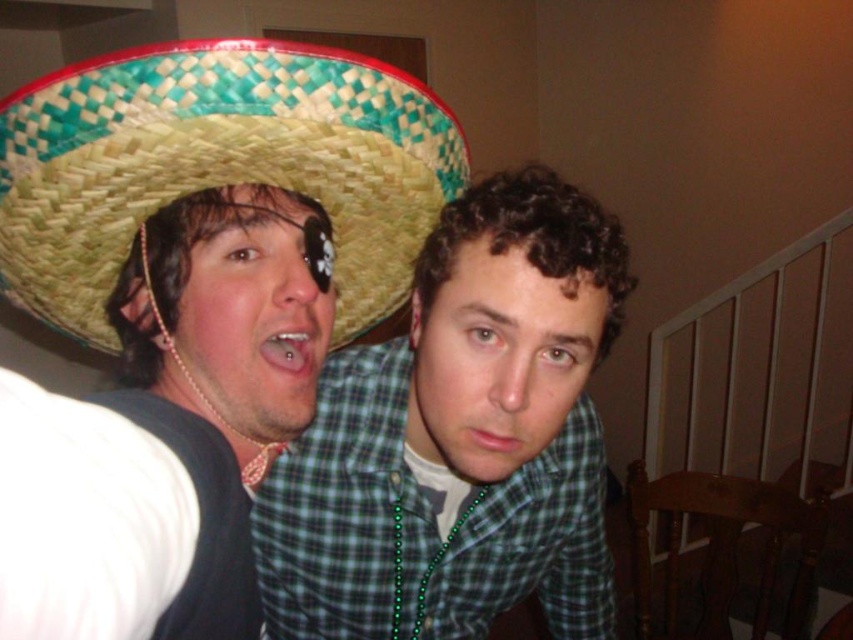
You are a photographer trying to capture a closeup shot of both the green plaid shirt at center and the woven straw sombrero at upper left. Your camera has a lens that can focus on objects within a 5 inch range. Can you fit both items in the frame without moving the camera?

The distance between the green plaid shirt at center and the woven straw sombrero at upper left is 6.76 inches, which exceeds the 5 inch range of the camera lens. Therefore, you cannot fit both items in the frame without moving the camera.

You are a photographer trying to capture both the green plaid shirt at center and the woven straw sombrero at upper left in a single photo. However, the camera can only focus on objects in the foreground. Which of the two items will be in focus?

The woven straw sombrero at upper left is behind the green plaid shirt at center, so the green plaid shirt at center will be in focus as it is in the foreground.

You are organizing a costume party and need to ensure all outfits fit through a narrow doorway. The doorway has a width limit of 1 meter. You have two outfits to check the green plaid shirt at center and the woven straw sombrero at upper left. Which outfit is more likely to exceed the doorway width limit?

The green plaid shirt at center is wider than the woven straw sombrero at upper left, so the green plaid shirt at center is more likely to exceed the doorway width limit.